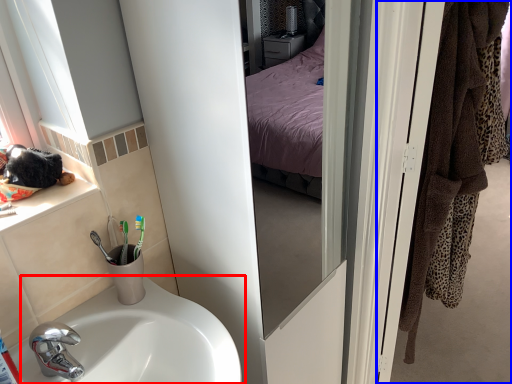
Question: Which object appears closest to the camera in this image, sink (highlighted by a red box) or door (highlighted by a blue box)?

Choices:
 (A) sink
 (B) door

Answer: (A)